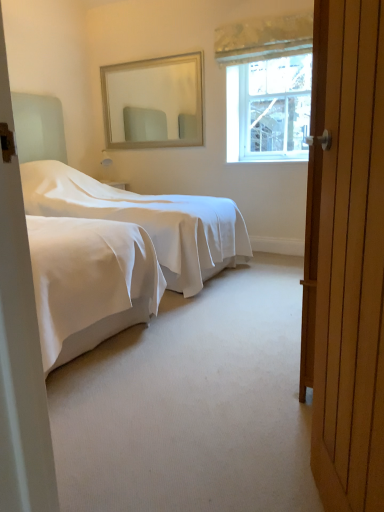
Question: Is wooden door at right inside or outside of textured cream curtain at upper center?

Choices:
 (A) inside
 (B) outside

Answer: (B)

Question: Is wooden door at right bigger or smaller than textured cream curtain at upper center?

Choices:
 (A) big
 (B) small

Answer: (A)

Question: Which object is positioned farthest from the textured cream curtain at upper center?

Choices:
 (A) beige framed mirror at upper center
 (B) white smooth bed at center
 (C) clear glass window at upper right
 (D) wooden door at right

Answer: (D)

Question: Estimate the real-world distances between objects in this image. Which object is closer to the clear glass window at upper right?

Choices:
 (A) textured cream curtain at upper center
 (B) white smooth bed at center
 (C) wooden door at right
 (D) beige framed mirror at upper center

Answer: (A)